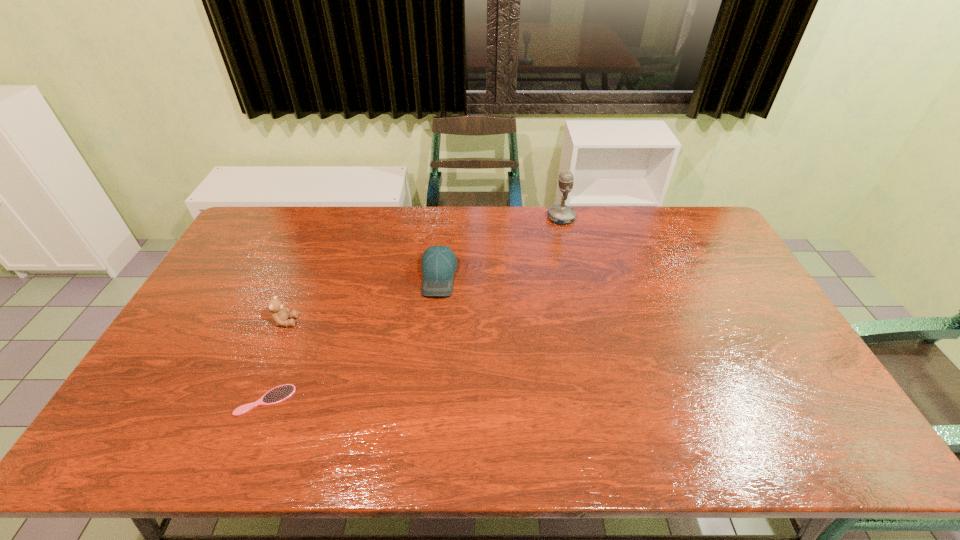
Where is `the farthest object`? the farthest object is located at coordinates (561, 214).

Where is `microphone`? This screenshot has width=960, height=540. microphone is located at coordinates (561, 214).

The image size is (960, 540). In order to click on teddy bear in this screenshot , I will do `click(280, 314)`.

Locate an element on the screen. The image size is (960, 540). baseball cap is located at coordinates (438, 263).

I want to click on the third object from left to right, so tap(438, 263).

Identify the location of the shortest object. (276, 395).

Image resolution: width=960 pixels, height=540 pixels. In order to click on the nearest object in this screenshot , I will do `click(276, 395)`.

Image resolution: width=960 pixels, height=540 pixels. In order to click on vacant region located 0.220m on the front-facing side of the microphone in this screenshot , I will do `click(490, 218)`.

What are the coordinates of `free region located on the front-facing side of the microphone` in the screenshot? It's located at point(481,218).

Where is `vacant area situated 0.320m on the front-facing side of the microphone`? Image resolution: width=960 pixels, height=540 pixels. vacant area situated 0.320m on the front-facing side of the microphone is located at coordinates (463, 218).